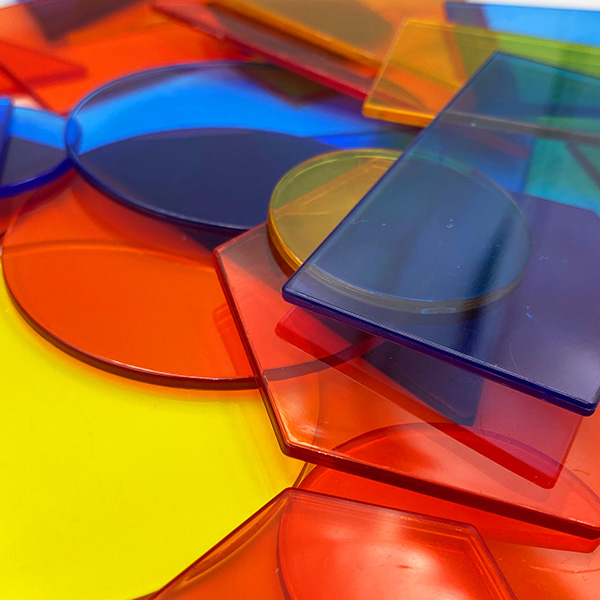
Locate an element on the screen. orange glass is located at coordinates (412, 76).